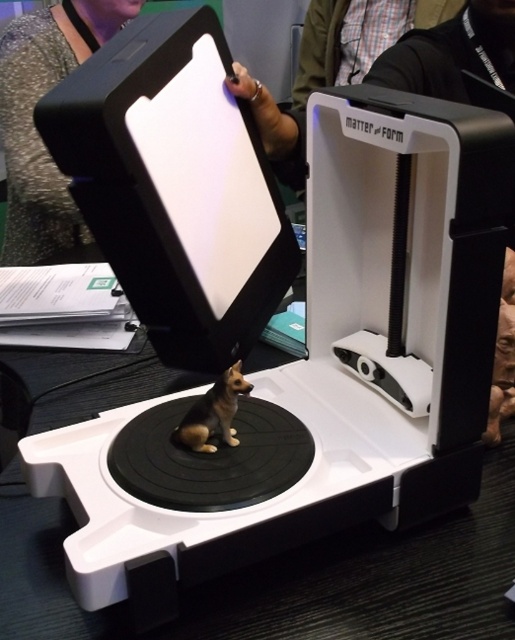
You are an assistant helping a customer choose between two items in a store. The customer wants to know which item is bigger. The items are the sparkly silver shirt at upper left and the brown matte dog at center. Can you tell them?

The sparkly silver shirt at upper left is larger in size than the brown matte dog at center.

You are an observer looking at the image of the 3D scanner and its contents. Which object, the sparkly silver shirt at upper left or the brown matte dog at center, is positioned higher up in the image?

The sparkly silver shirt at upper left is positioned higher up in the image as it is much taller than the brown matte dog at center.

You are standing in front of a 3D scanner and want to place a small tool on the scanning surface. The tool requires a minimum of 1.5 meters distance from the camera to function properly. Is the point at coordinates point (71, 228) on the scanning surface far enough for the tool to work?

The distance of point (71, 228) from the camera is 1.42 meters, which is less than the required 1.5 meters. Therefore, the tool will not function properly at that point.